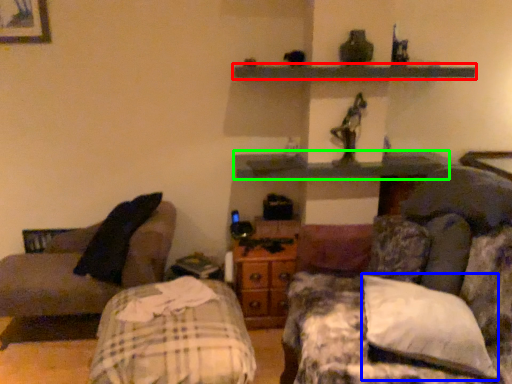
Question: Which object is positioned farthest from shelf (highlighted by a red box)? Select from pillow (highlighted by a blue box) and shelf (highlighted by a green box).

Choices:
 (A) pillow
 (B) shelf

Answer: (A)